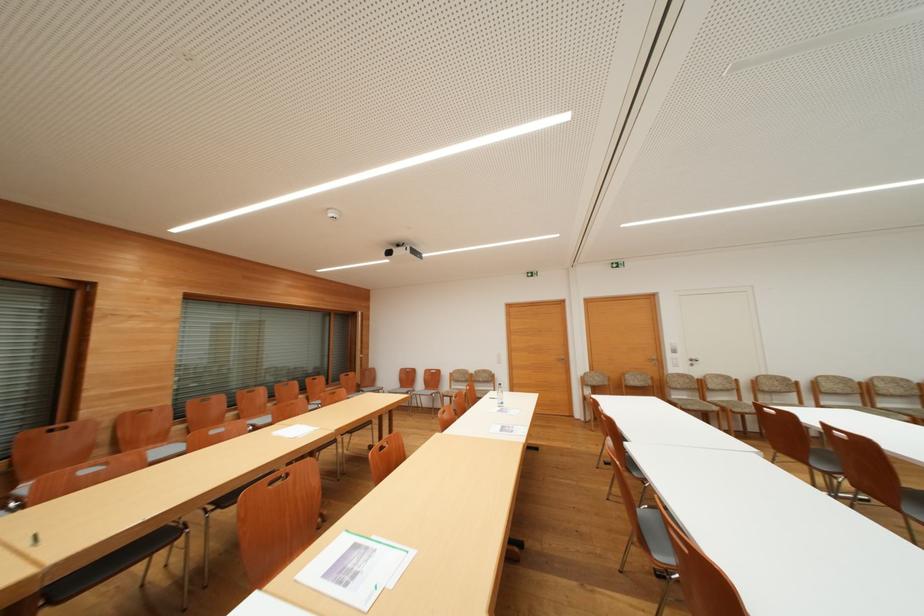
Where is `light switch panel`? Image resolution: width=924 pixels, height=616 pixels. light switch panel is located at coordinates (681, 359).